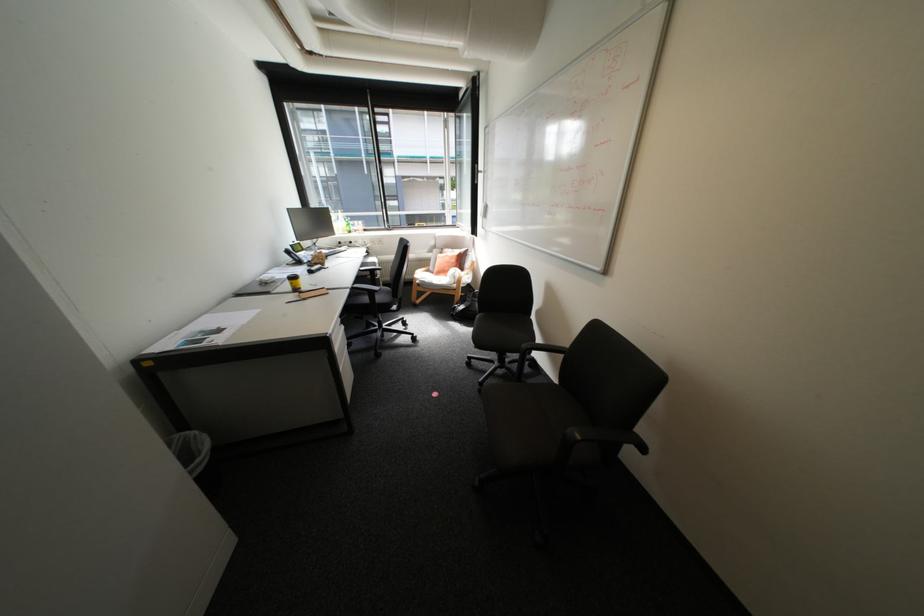
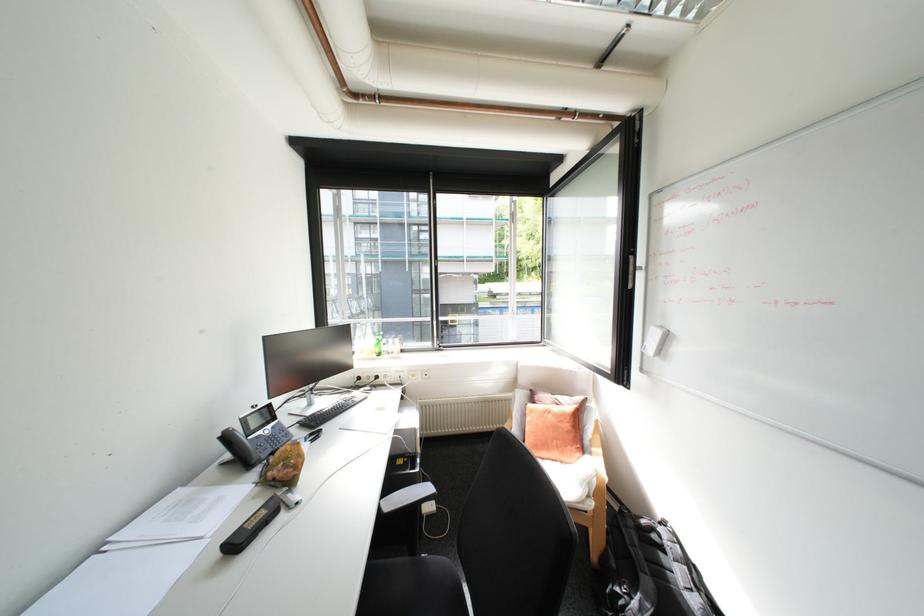
In the second image, find the point that corresponds to point 384,262 in the first image.

(424, 429)